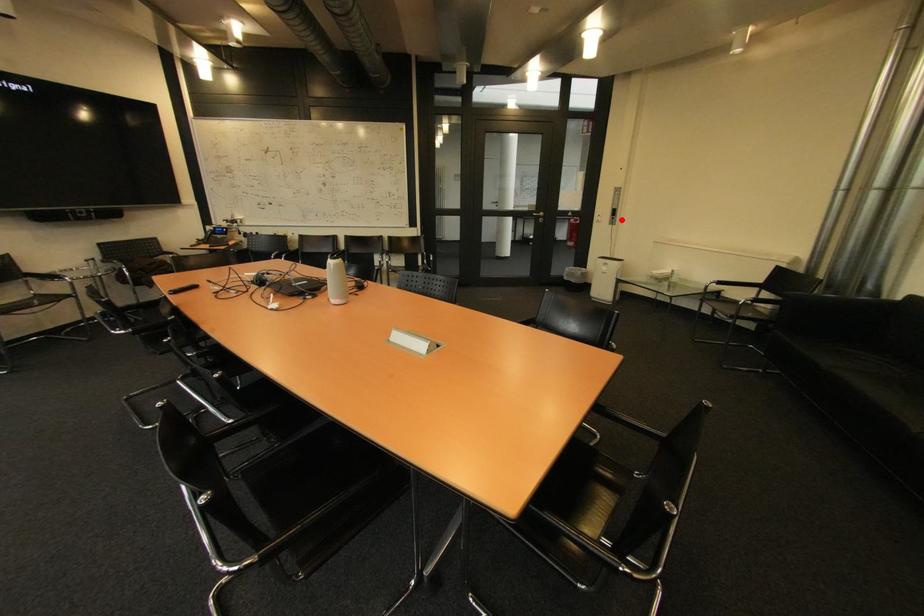
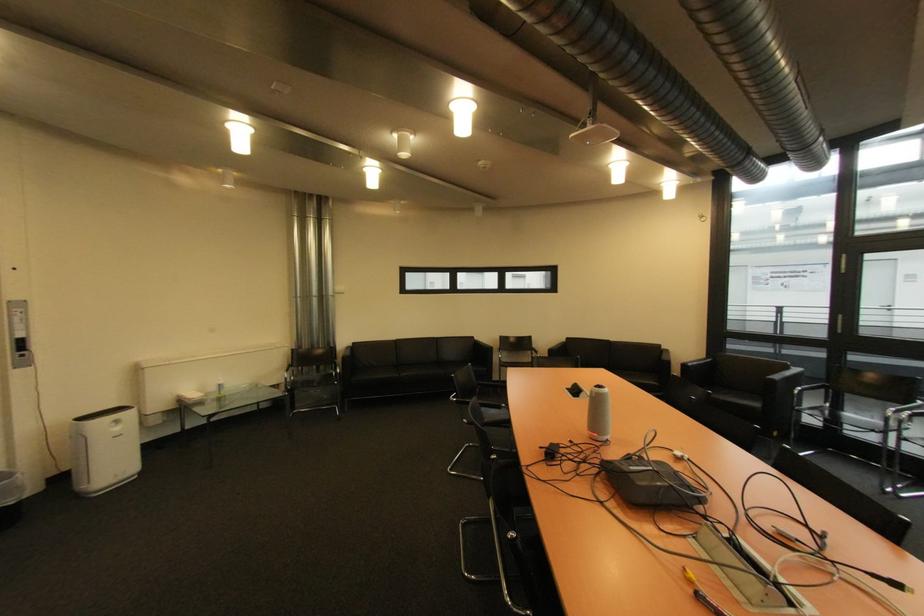
Question: A red point is marked in image1. In image2, is the corresponding 3D point closer to the camera or farther? Reply with the corresponding letter.

Choices:
 (A) The corresponding 3D point is closer.
 (B) The corresponding 3D point is farther.

Answer: (B)